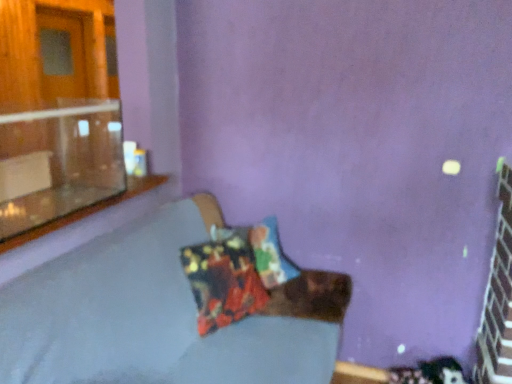
Question: Can you confirm if printed fabric pillow at center is positioned to the left of transparent glass window at upper left?

Choices:
 (A) yes
 (B) no

Answer: (B)

Question: Is printed fabric pillow at center positioned before transparent glass window at upper left?

Choices:
 (A) no
 (B) yes

Answer: (A)

Question: Would you say printed fabric pillow at center contains transparent glass window at upper left?

Choices:
 (A) yes
 (B) no

Answer: (B)

Question: From a real-world perspective, is printed fabric pillow at center located higher than transparent glass window at upper left?

Choices:
 (A) yes
 (B) no

Answer: (B)

Question: From the image's perspective, is printed fabric pillow at center on transparent glass window at upper left?

Choices:
 (A) no
 (B) yes

Answer: (A)

Question: Which is correct: textured fabric couch at center is inside printed fabric pillow at center, or outside of it?

Choices:
 (A) inside
 (B) outside

Answer: (B)

Question: From a real-world perspective, is textured fabric couch at center above or below printed fabric pillow at center?

Choices:
 (A) above
 (B) below

Answer: (B)

Question: Looking at their shapes, would you say textured fabric couch at center is wider or thinner than printed fabric pillow at center?

Choices:
 (A) thin
 (B) wide

Answer: (B)

Question: Would you say textured fabric couch at center is to the left or to the right of printed fabric pillow at center in the picture?

Choices:
 (A) right
 (B) left

Answer: (B)

Question: In terms of width, does clear glass window sill at upper left look wider or thinner when compared to textured fabric couch at center?

Choices:
 (A) thin
 (B) wide

Answer: (A)

Question: From the image's perspective, is clear glass window sill at upper left positioned above or below textured fabric couch at center?

Choices:
 (A) below
 (B) above

Answer: (B)

Question: Relative to textured fabric couch at center, is clear glass window sill at upper left in front or behind?

Choices:
 (A) behind
 (B) front

Answer: (A)

Question: Considering the relative positions of clear glass window sill at upper left and textured fabric couch at center in the image provided, is clear glass window sill at upper left to the left or to the right of textured fabric couch at center?

Choices:
 (A) left
 (B) right

Answer: (A)

Question: From a real-world perspective, is textured fabric couch at center physically located above or below clear glass window sill at upper left?

Choices:
 (A) above
 (B) below

Answer: (B)

Question: From the image's perspective, is textured fabric couch at center above or below clear glass window sill at upper left?

Choices:
 (A) above
 (B) below

Answer: (B)